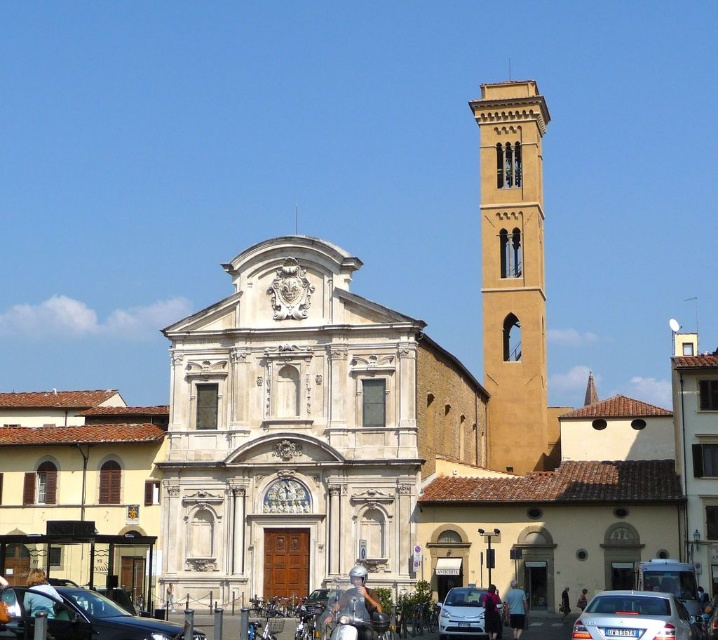
Question: Is matte black car at lower left to the left of shiny chrome scooter at lower center from the viewer's perspective?

Choices:
 (A) no
 (B) yes

Answer: (B)

Question: Among these objects, which one is nearest to the camera?

Choices:
 (A) silver metallic car at lower center
 (B) white marble church at center
 (C) matte black car at lower left

Answer: (C)

Question: Among these points, which one is farthest from the camera?

Choices:
 (A) (484, 588)
 (B) (648, 627)
 (C) (113, 634)
 (D) (372, 608)

Answer: (A)

Question: Can you confirm if matte black car at lower left is smaller than silver metallic sedan at lower right?

Choices:
 (A) yes
 (B) no

Answer: (A)

Question: Is matte black car at lower left wider than silver metallic car at lower center?

Choices:
 (A) yes
 (B) no

Answer: (A)

Question: Which point is closer to the camera?

Choices:
 (A) silver metallic car at lower center
 (B) silver metallic sedan at lower right
 (C) matte black car at lower left
 (D) shiny chrome scooter at lower center

Answer: (C)